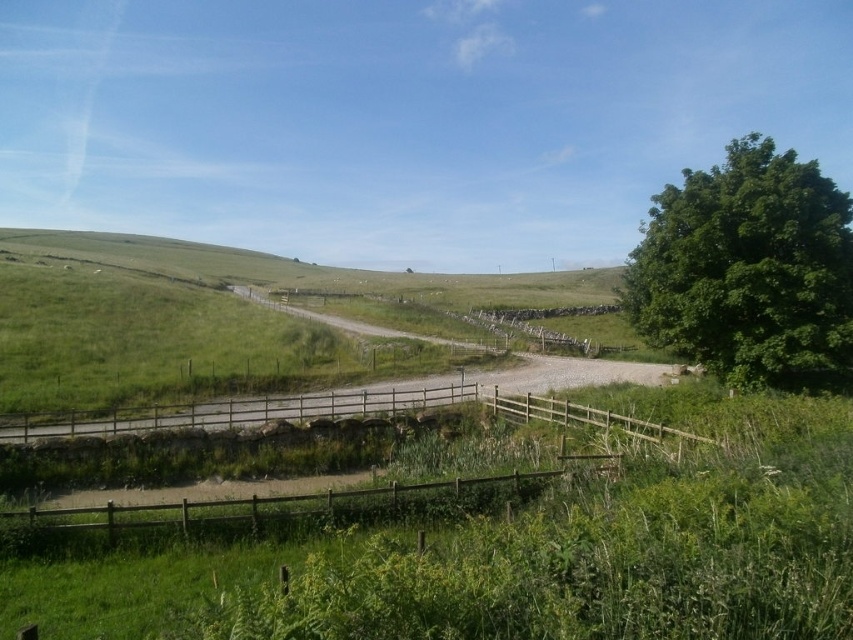
Does green grassy hillside at center appear under green leafy tree at right?

No, green grassy hillside at center is not below green leafy tree at right.

Between green grassy hillside at center and green leafy tree at right, which one is positioned higher?

green grassy hillside at center is higher up.

What do you see at coordinates (222, 320) in the screenshot? I see `green grassy hillside at center` at bounding box center [222, 320].

The image size is (853, 640). Find the location of `green grassy hillside at center`. green grassy hillside at center is located at coordinates (222, 320).

Describe the element at coordinates (747, 268) in the screenshot. I see `green leafy tree at right` at that location.

Can you confirm if green leafy tree at right is shorter than brown wooden fence at lower center?

No.

This screenshot has height=640, width=853. What do you see at coordinates (747, 268) in the screenshot?
I see `green leafy tree at right` at bounding box center [747, 268].

Locate an element on the screen. green leafy tree at right is located at coordinates (747, 268).

Is the position of green grassy hillside at center less distant than that of brown wooden fence at lower center?

No, green grassy hillside at center is behind brown wooden fence at lower center.

Where is `green grassy hillside at center`? This screenshot has width=853, height=640. green grassy hillside at center is located at coordinates (222, 320).

The image size is (853, 640). I want to click on green grassy hillside at center, so [x=222, y=320].